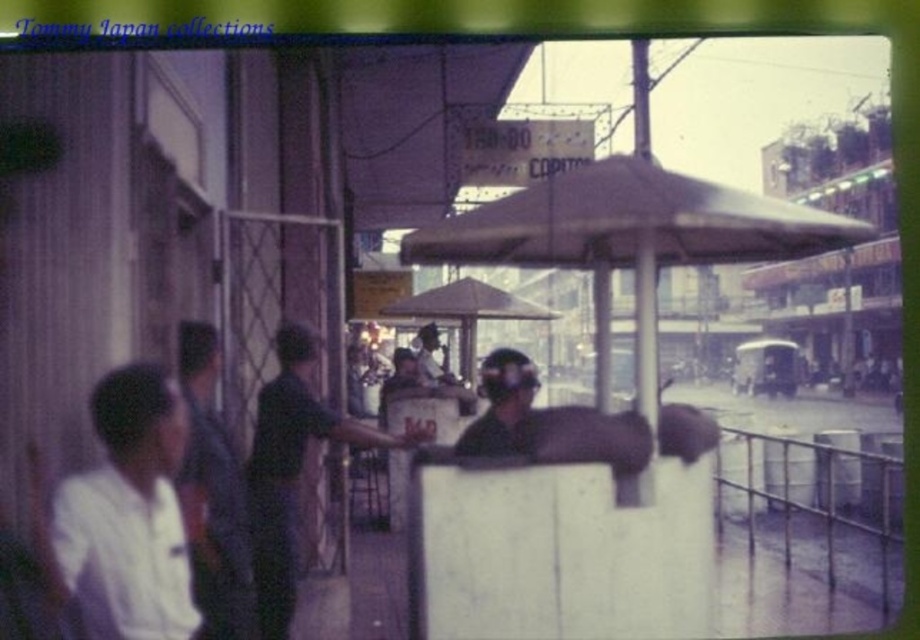
Between matte brown umbrella at center and brown matte umbrella at center, which one appears on the right side from the viewer's perspective?

matte brown umbrella at center

Who is more distant from viewer, (618,195) or (462,285)?

Point (462,285)

I want to click on matte brown umbrella at center, so click(x=629, y=224).

Does matte brown umbrella at center have a greater width compared to white cotton shirt at lower left?

Yes, matte brown umbrella at center is wider than white cotton shirt at lower left.

Is point (608, 253) in front of point (33, 509)?

No, (608, 253) is further to viewer.

The height and width of the screenshot is (640, 920). What do you see at coordinates (629, 224) in the screenshot?
I see `matte brown umbrella at center` at bounding box center [629, 224].

The width and height of the screenshot is (920, 640). What are the coordinates of `matte brown umbrella at center` in the screenshot? It's located at (629, 224).

Can you confirm if matte brown umbrella at center is positioned to the left of dark blue shirt at left?

No, matte brown umbrella at center is not to the left of dark blue shirt at left.

Is point (819, 234) in front of point (210, 502)?

No.

Where is `matte brown umbrella at center`? matte brown umbrella at center is located at coordinates (629, 224).